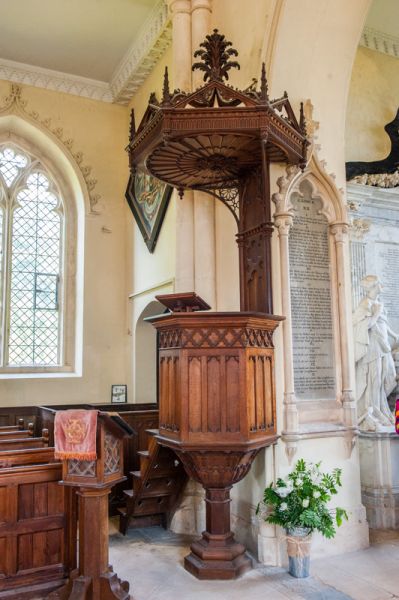
The width and height of the screenshot is (399, 600). Identify the location of statue. (381, 358).